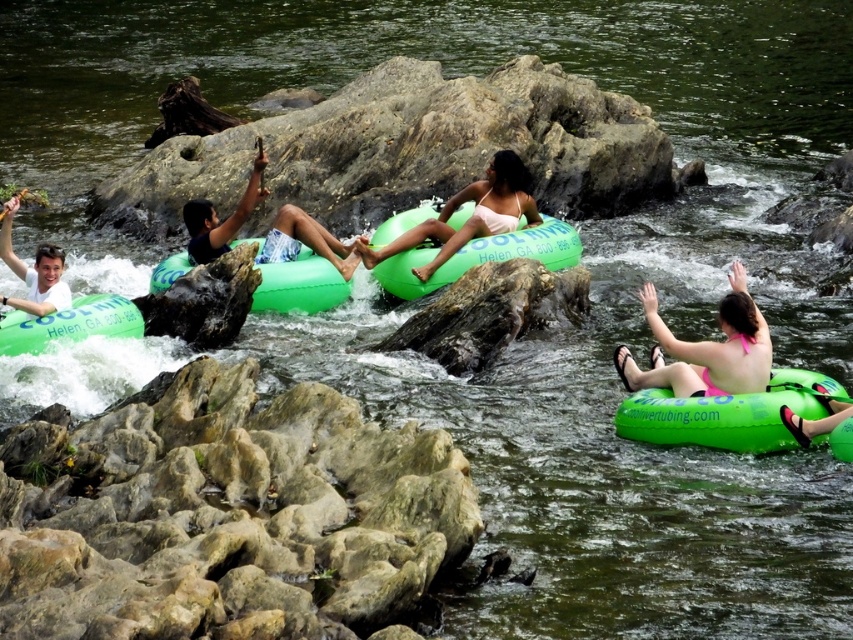
Question: Based on their relative distances, which object is nearer to the green inflatable raft at center?

Choices:
 (A) rocky at center
 (B) green rubber raft at center
 (C) gray rock at center
 (D) green rubber tube at center

Answer: (D)

Question: Considering the real-world distances, which object is farthest from the gray rock at center?

Choices:
 (A) green inflatable raft at center
 (B) green rubber tube at left
 (C) green rubber tube at lower right
 (D) white matte shirt at upper left

Answer: (C)

Question: Can you confirm if rocky at center is positioned to the left of gray rock at center?

Choices:
 (A) yes
 (B) no

Answer: (A)

Question: Can you confirm if rocky at center is positioned to the right of pink fabric bikini at lower right?

Choices:
 (A) yes
 (B) no

Answer: (B)

Question: From the image, what is the correct spatial relationship of pink fabric bikini at lower right in relation to green inflatable raft at center?

Choices:
 (A) left
 (B) right

Answer: (B)

Question: Which point appears closest to the camera in this image?

Choices:
 (A) (614, 352)
 (B) (506, 182)

Answer: (A)